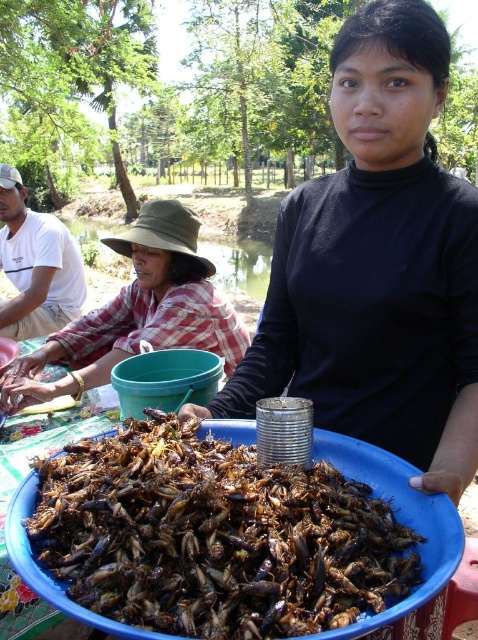
You are a chef preparing a dish and need to determine which container to use for serving. Given the black matte bowl at center and the brown matte insects at center, which one is taller?

The black matte bowl at center is much taller than the brown matte insects at center, so the bowl is taller.

You are a food vendor at an outdoor market and see the brown matte insects at center and the plaid fabric shirt at left. Which item is positioned to the right of the other?

The brown matte insects at center are to the right of the plaid fabric shirt at left.

You are a food vendor preparing a dish and need to place the black matte bowl at center on top of the white cotton shirt at left. Is this possible based on their sizes?

The black matte bowl at center is much taller than the white cotton shirt at left, so placing the bowl on top of the shirt may not be stable or practical due to the bowl being significantly taller.